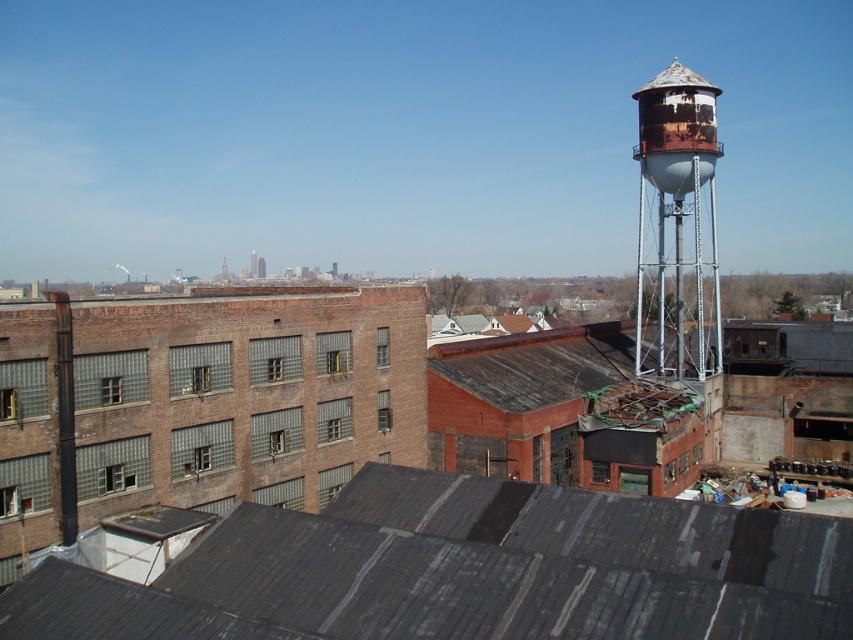
You are an urban planner evaluating the image. You need to determine which structure occupies more visual space in the scene. Which one is larger in size between the dark gray corrugated metal roof at center and the rusty metal water tower at upper right?

The dark gray corrugated metal roof at center has a smaller size compared to the rusty metal water tower at upper right, so the rusty metal water tower at upper right occupies more visual space in the scene.

You are a city planner reviewing this area. You need to assess the distance between the dark gray corrugated metal roof at center and the rusty metal water tower at upper right. Which direction should you look to see both objects in the same field of view?

You should look to the left of the rusty metal water tower at upper right to see both the dark gray corrugated metal roof at center and the rusty metal water tower at upper right in the same field of view.